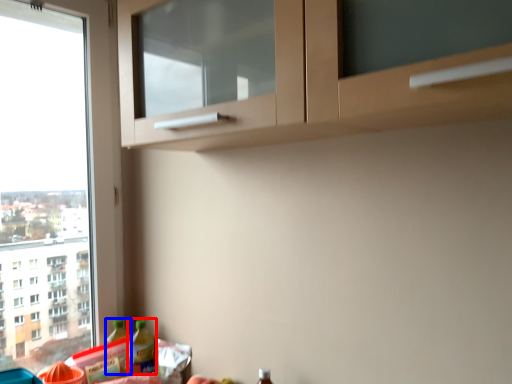
Question: Which of the following is the closest to the observer, bottle (highlighted by a red box) or bottle (highlighted by a blue box)?

Choices:
 (A) bottle
 (B) bottle

Answer: (A)